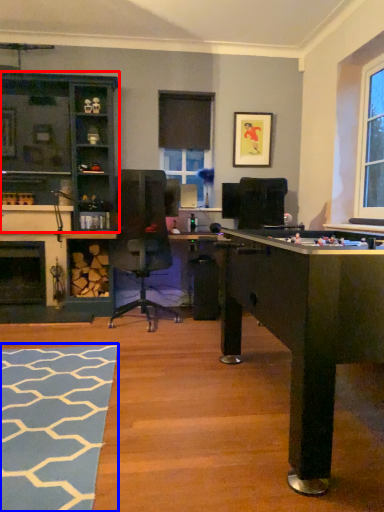
Question: Which object appears closest to the camera in this image, cabinetry (highlighted by a red box) or flat (highlighted by a blue box)?

Choices:
 (A) cabinetry
 (B) flat

Answer: (B)